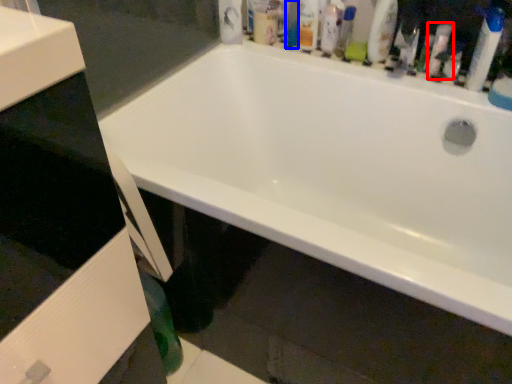
Question: Among these objects, which one is farthest to the camera, cleaning product (highlighted by a red box) or mouthwash (highlighted by a blue box)?

Choices:
 (A) cleaning product
 (B) mouthwash

Answer: (B)